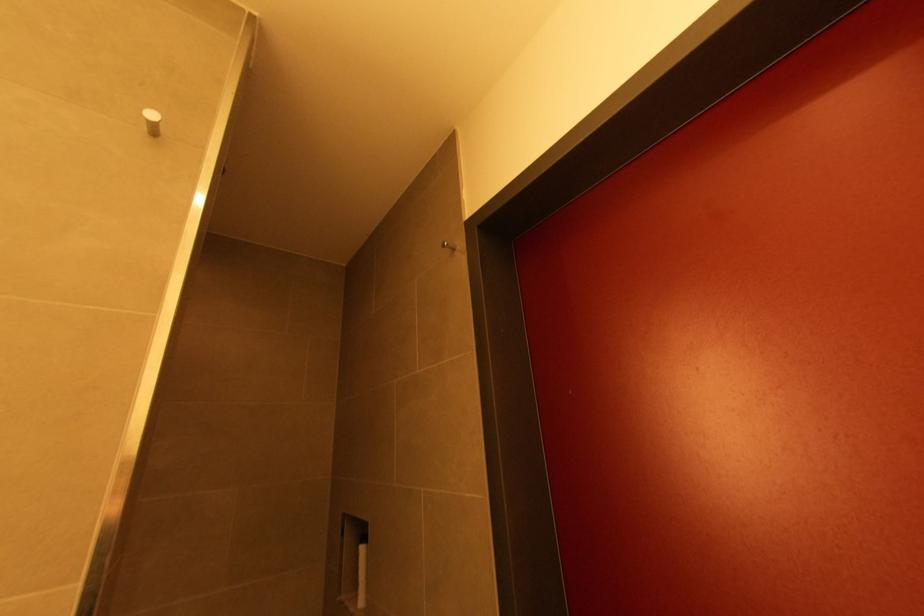
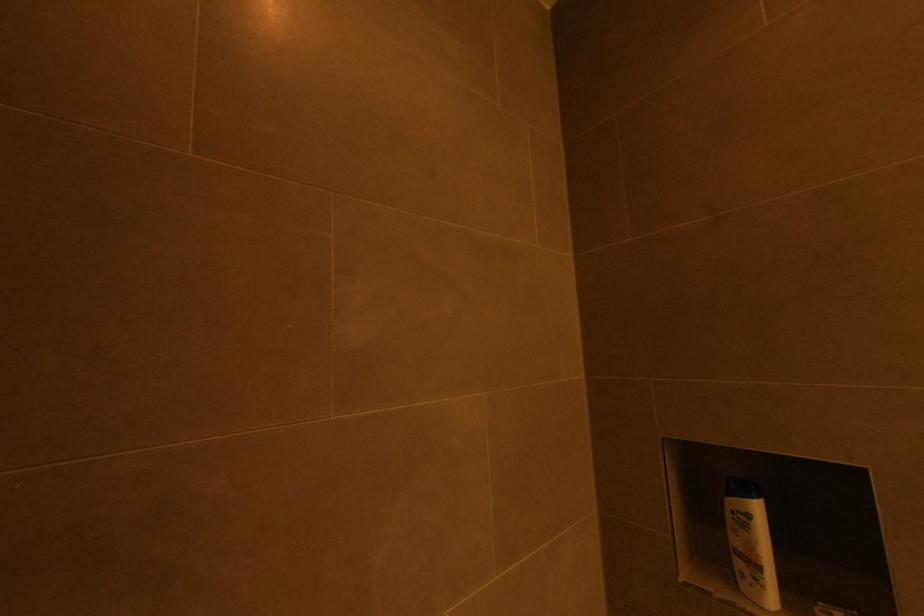
In a continuous first-person perspective shot, in which direction is the camera moving?

The cameraman moved toward left, forward.